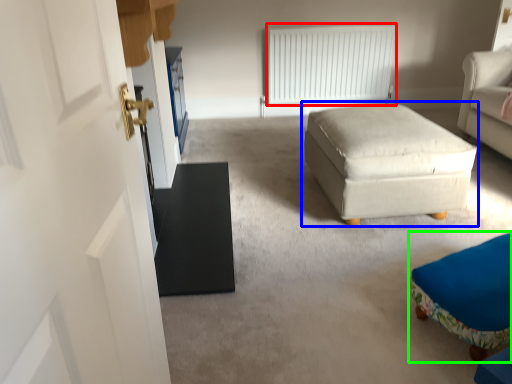
Question: Which object is the closest to the radiator (highlighted by a red box)? Choose among these: table (highlighted by a blue box) or furniture (highlighted by a green box).

Choices:
 (A) table
 (B) furniture

Answer: (A)